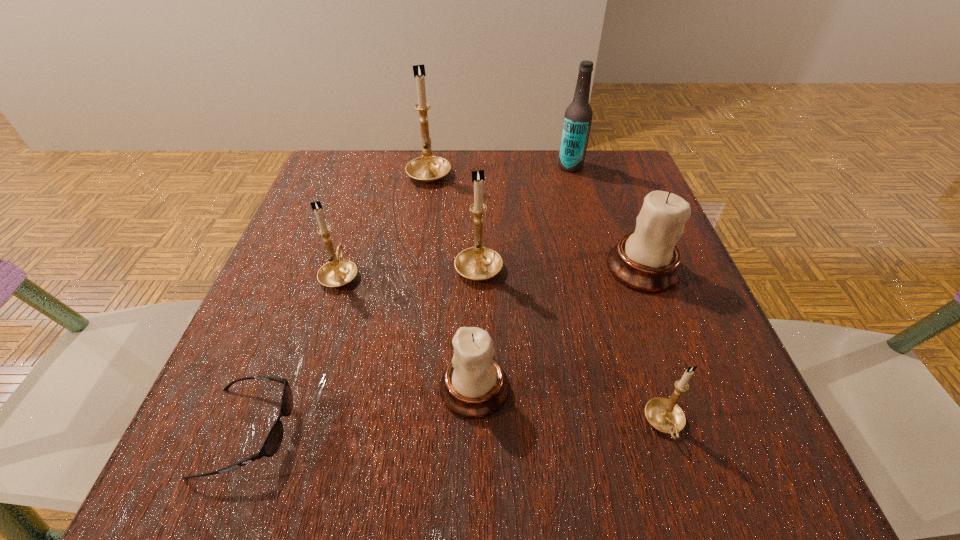
Where is `free space located 0.150m on the handle side of the second biggest gold candle holder`? The height and width of the screenshot is (540, 960). free space located 0.150m on the handle side of the second biggest gold candle holder is located at coordinates (479, 200).

Find the location of a particular element. Image resolution: width=960 pixels, height=540 pixels. free spot located 0.370m on the left of the bigger white candle holder is located at coordinates (408, 268).

Locate an element on the screen. The image size is (960, 540). free region located 0.150m on the handle side of the second smallest gold candle holder is located at coordinates (361, 210).

What are the coordinates of `vacant space located on the handle side of the second smallest gold candle holder` in the screenshot? It's located at (378, 153).

I want to click on vacant area located on the handle side of the second smallest gold candle holder, so click(x=371, y=179).

Locate an element on the screen. This screenshot has height=540, width=960. blank space located 0.210m on the left of the smaller white candle holder is located at coordinates (296, 388).

You are a GUI agent. You are given a task and a screenshot of the screen. Output one action in this format:
    pyautogui.click(x=<x>, y=<y>)
    Task: Click on the free space located 0.060m on the handle side of the nearest gold candle holder
    The height and width of the screenshot is (540, 960).
    Given the screenshot: What is the action you would take?
    pyautogui.click(x=687, y=496)

At what (x,y) coordinates should I click in order to perform the action: click on free location located on the front-facing side of the shortest object. Please return your answer as a coordinate pair (x, y). The width and height of the screenshot is (960, 540). Looking at the image, I should click on (x=529, y=431).

Where is `candle holder that is at the far edge`? candle holder that is at the far edge is located at coordinates (428, 168).

Where is `beer bottle at the far edge`? beer bottle at the far edge is located at coordinates (578, 116).